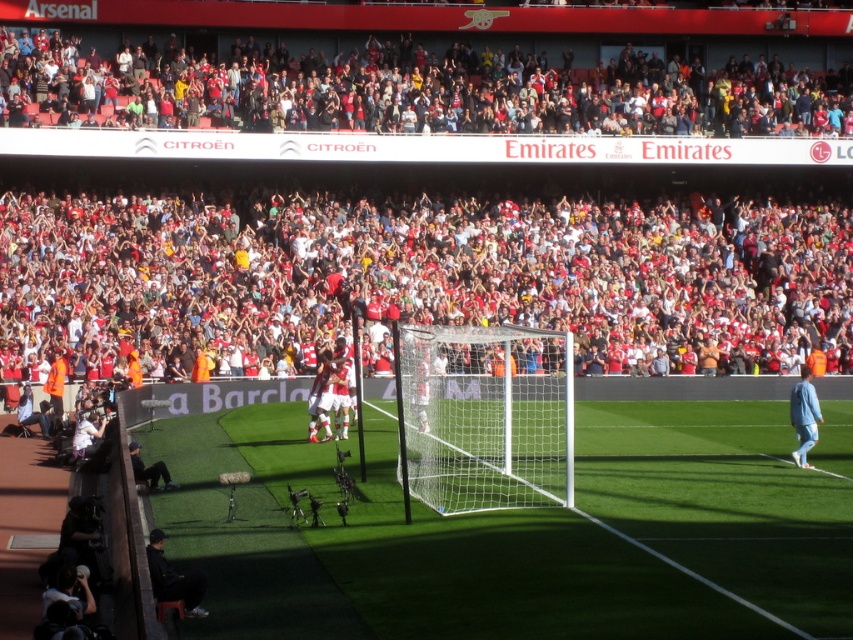
You are a photographer at the Emirates Stadium. You want to take a photo focusing on the green artificial turf at center and the white mesh net at center. Which object will appear larger in your photo?

The green artificial turf at center will appear larger in the photo because it is closer to the viewer than the white mesh net at center.

You are a photographer at Emirates Stadium and want to capture a photo that highlights the green artificial turf at center without the red fabric crowd at upper center being too prominent. Based on their sizes, which object should you focus on to ensure the crowd isn

The green artificial turf at center is smaller in size compared to the red fabric crowd at upper center. To minimize the prominence of the crowd, focus on the green artificial turf at center since its smaller size will naturally take up less space in the photo, allowing the crowd to appear relatively smaller in the frame.